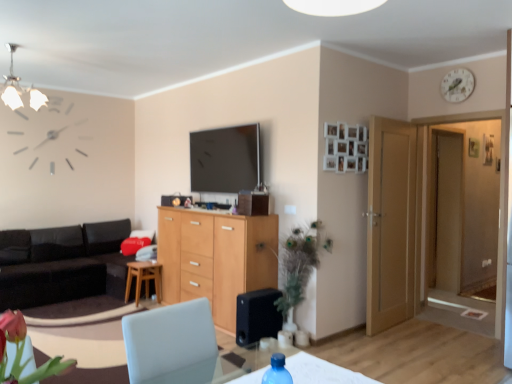
What are the coordinates of `white wooden clock at upper right` in the screenshot? It's located at (457, 85).

Measure the distance between transparent glass door at right and camera.

The depth of transparent glass door at right is 4.60 meters.

Measure the distance between green leafy plant at center and camera.

A distance of 3.70 meters exists between green leafy plant at center and camera.

What do you see at coordinates (297, 265) in the screenshot?
I see `green leafy plant at center` at bounding box center [297, 265].

What is the approximate width of black leather couch at left?

The width of black leather couch at left is 1.39 meters.

Locate an element on the screen. Image resolution: width=512 pixels, height=384 pixels. white wooden clock at upper right is located at coordinates (457, 85).

Where is `floral arrangement located above the black matte speaker at lower center (from the image's perspective)`? Image resolution: width=512 pixels, height=384 pixels. floral arrangement located above the black matte speaker at lower center (from the image's perspective) is located at coordinates (297, 265).

Is green leafy plant at center aimed at black matte speaker at lower center?

Yes.

From a real-world perspective, is green leafy plant at center below black matte speaker at lower center?

Actually, green leafy plant at center is physically above black matte speaker at lower center in the real world.

Does point (282, 315) come behind point (258, 340)?

Yes, it is behind point (258, 340).

Between wooden door at right and transparent glass door at right, which one has larger size?

transparent glass door at right.

How far apart are wooden door at right and transparent glass door at right?

The distance of wooden door at right from transparent glass door at right is 1.17 meters.

In the image, is wooden door at right on the left side or the right side of transparent glass door at right?

In the image, wooden door at right appears on the left side of transparent glass door at right.

From a real-world perspective, which is physically above, wooden door at right or transparent glass door at right?

transparent glass door at right, from a real-world perspective.

Which object is more forward, transparent plastic water bottle at lower center or white wooden clock at upper right?

transparent plastic water bottle at lower center is closer to the camera.

Can you confirm if transparent plastic water bottle at lower center is taller than white wooden clock at upper right?

In fact, transparent plastic water bottle at lower center may be shorter than white wooden clock at upper right.

From the image's perspective, is transparent plastic water bottle at lower center located beneath white wooden clock at upper right?

Yes.

Is black leather couch at left positioned behind metallic chandelier at upper left?

Yes.

In the scene shown: Looking at the image, does black leather couch at left seem bigger or smaller compared to metallic chandelier at upper left?

In the image, black leather couch at left appears to be larger than metallic chandelier at upper left.

In the scene shown: Is black leather couch at left looking in the opposite direction of metallic chandelier at upper left?

No, metallic chandelier at upper left is not at the back of black leather couch at left.

Consider the image. Considering the relative positions of black leather couch at left and metallic chandelier at upper left in the image provided, is black leather couch at left to the left of metallic chandelier at upper left from the viewer's perspective?

Indeed, black leather couch at left is positioned on the left side of metallic chandelier at upper left.

Is wooden door at right taller or shorter than light wood cabinet at center?

wooden door at right is taller than light wood cabinet at center.

Locate an element on the screen. cabinetry that appears in front of the wooden door at right is located at coordinates (215, 258).

Between wooden door at right and light wood cabinet at center, which one is positioned behind?

wooden door at right is further away from the camera.

Does black leather couch at left appear on the right side of white wooden clock at upper right?

Incorrect, black leather couch at left is not on the right side of white wooden clock at upper right.

Is black leather couch at left bigger or smaller than white wooden clock at upper right?

black leather couch at left is bigger than white wooden clock at upper right.

Relative to black matte speaker at lower center, is metallic chandelier at upper left in front or behind?

metallic chandelier at upper left is in front of black matte speaker at lower center.

From a real-world perspective, does metallic chandelier at upper left sit lower than black matte speaker at lower center?

No, from a real-world perspective, metallic chandelier at upper left is not below black matte speaker at lower center.

From the image's perspective, which is above, metallic chandelier at upper left or black matte speaker at lower center?

metallic chandelier at upper left.

Considering the sizes of objects metallic chandelier at upper left and black matte speaker at lower center in the image provided, who is shorter, metallic chandelier at upper left or black matte speaker at lower center?

With less height is black matte speaker at lower center.

Identify the location of floral arrangement on the right of black matte speaker at lower center. (297, 265).

Locate an element on the screen. door in front of the transparent glass door at right is located at coordinates (391, 223).

Which object lies nearer to the anchor point transparent plastic water bottle at lower center, black leather couch at left or green leafy plant at center?

Among the two, green leafy plant at center is located nearer to transparent plastic water bottle at lower center.

Considering their positions, is light wood cabinet at center positioned further to wooden stool at center than wooden door at right?

The object further to wooden stool at center is wooden door at right.

When comparing their distances from green leafy plant at center, does light wood cabinet at center or black leather couch at left seem further?

black leather couch at left lies further to green leafy plant at center than the other object.

Looking at the image, which one is located further to metallic chandelier at upper left, wooden door at right or light wood cabinet at center?

wooden door at right lies further to metallic chandelier at upper left than the other object.

From the image, which object appears to be nearer to white wooden clock at upper right, wooden door at right or black matte speaker at lower center?

Based on the image, wooden door at right appears to be nearer to white wooden clock at upper right.

When comparing their distances from white wooden clock at upper right, does light wood cabinet at center or black matte speaker at lower center seem closer?

black matte speaker at lower center is closer to white wooden clock at upper right.

From the picture: Which object lies nearer to the anchor point black matte speaker at lower center, wooden door at right or green leafy plant at center?

green leafy plant at center is closer to black matte speaker at lower center.

Considering their positions, is black leather couch at left positioned closer to black matte speaker at lower center than wooden door at right?

Among the two, wooden door at right is located nearer to black matte speaker at lower center.

I want to click on cabinetry between metallic chandelier at upper left and transparent glass door at right, so click(x=215, y=258).

Image resolution: width=512 pixels, height=384 pixels. I want to click on floral arrangement located between light wood cabinet at center and transparent glass door at right in the left-right direction, so click(297, 265).

Image resolution: width=512 pixels, height=384 pixels. I want to click on floral arrangement located between transparent plastic water bottle at lower center and transparent glass door at right in the depth direction, so 297,265.

You are a GUI agent. You are given a task and a screenshot of the screen. Output one action in this format:
    pyautogui.click(x=<x>, y=<y>)
    Task: Click on the floral arrangement positioned between transparent plastic water bottle at lower center and wooden door at right from near to far
    
    Given the screenshot: What is the action you would take?
    pyautogui.click(x=297, y=265)